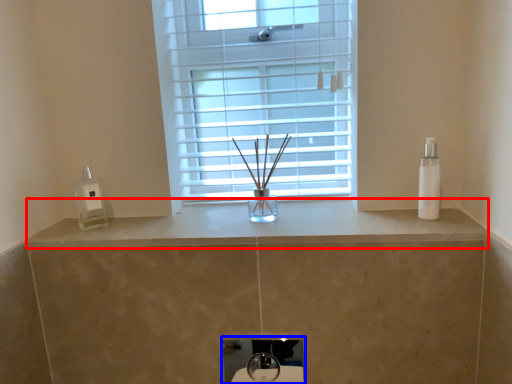
Question: Which point is closer to the camera, counter top (highlighted by a red box) or sink (highlighted by a blue box)?

Choices:
 (A) counter top
 (B) sink

Answer: (A)